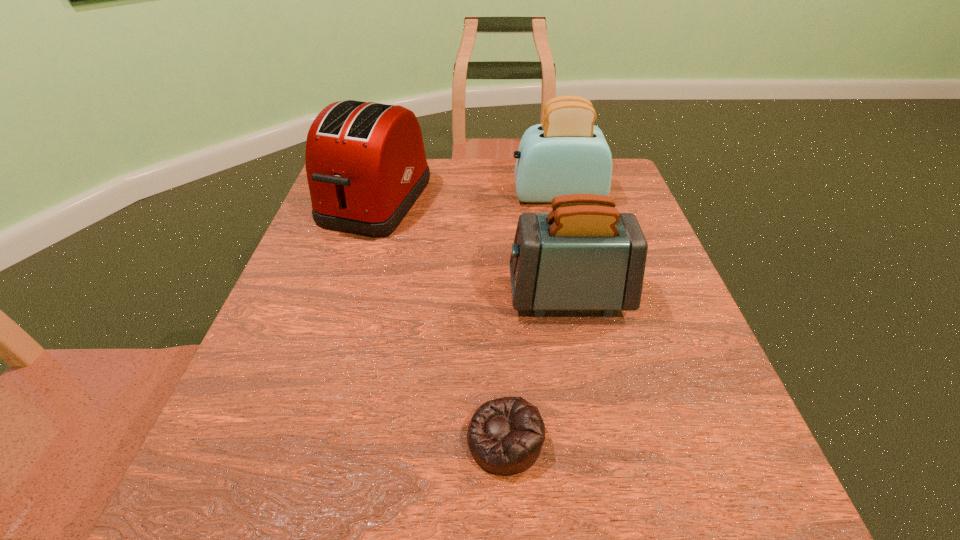
Locate an element on the screen. free space between the leftmost object and the shortest object is located at coordinates (441, 320).

Locate an element on the screen. Image resolution: width=960 pixels, height=540 pixels. vacant area that lies between the beanbag and the second nearest object is located at coordinates (537, 367).

You are a GUI agent. You are given a task and a screenshot of the screen. Output one action in this format:
    pyautogui.click(x=<x>, y=<y>)
    Task: Click on the object that is the closest to the beanbag
    The width and height of the screenshot is (960, 540).
    Given the screenshot: What is the action you would take?
    pyautogui.click(x=584, y=255)

Choose which object is the second nearest neighbor to the beanbag. Please provide its 2D coordinates. Your answer should be formatted as a tuple, i.e. [(x, y)], where the tuple contains the x and y coordinates of a point satisfying the conditions above.

[(366, 166)]

I want to click on toaster that is the closest to the leftmost toaster, so tap(567, 154).

Locate which toaster ranks in proximity to the leftmost toaster. Please provide its 2D coordinates. Your answer should be formatted as a tuple, i.e. [(x, y)], where the tuple contains the x and y coordinates of a point satisfying the conditions above.

[(567, 154)]